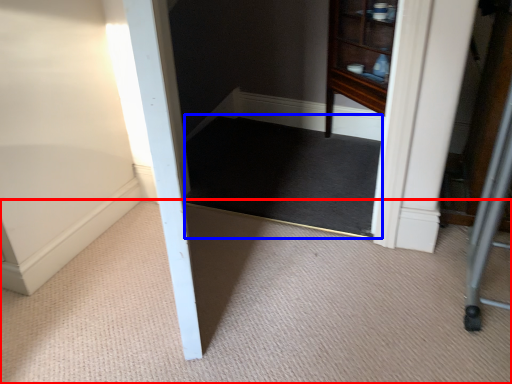
Question: Which object appears farthest to the camera in this image, plain (highlighted by a red box) or mat (highlighted by a blue box)?

Choices:
 (A) plain
 (B) mat

Answer: (B)